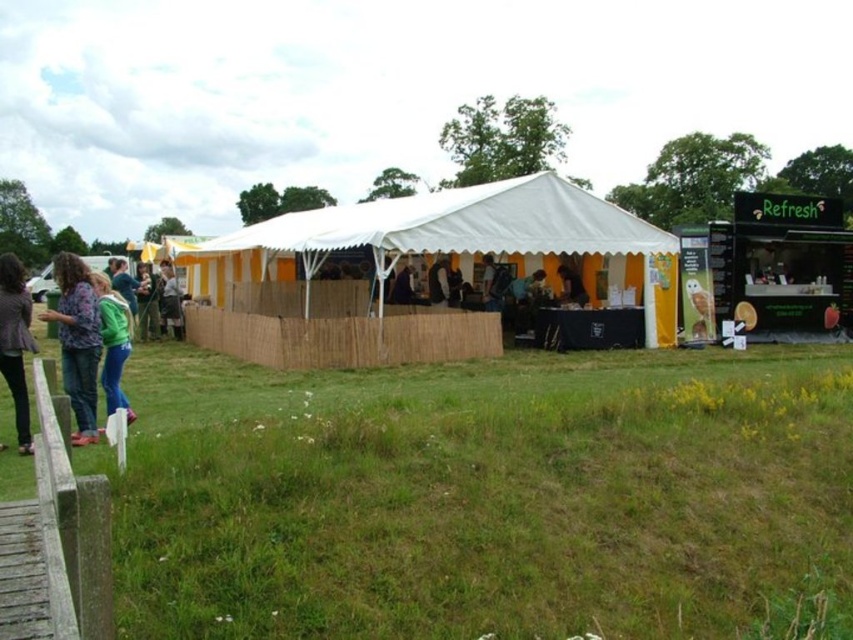
Question: Among these points, which one is farthest from the camera?

Choices:
 (A) (114, 349)
 (B) (421, 218)
 (C) (587, 456)

Answer: (B)

Question: Estimate the real-world distances between objects in this image. Which object is closer to the green fleece jacket at left?

Choices:
 (A) dark gray fabric jacket at center
 (B) denim jacket at left

Answer: (B)

Question: Can you confirm if green grass at lower center is thinner than matte yellow shirt at center?

Choices:
 (A) yes
 (B) no

Answer: (B)

Question: Is green fleece jacket at left closer to the viewer compared to matte yellow shirt at center?

Choices:
 (A) yes
 (B) no

Answer: (A)

Question: Among these points, which one is farthest from the camera?

Choices:
 (A) (582, 294)
 (B) (613, 236)
 (C) (578, 579)
 (D) (170, 324)

Answer: (A)

Question: Is dark gray textured jacket at left to the left of matte yellow shirt at center from the viewer's perspective?

Choices:
 (A) no
 (B) yes

Answer: (B)